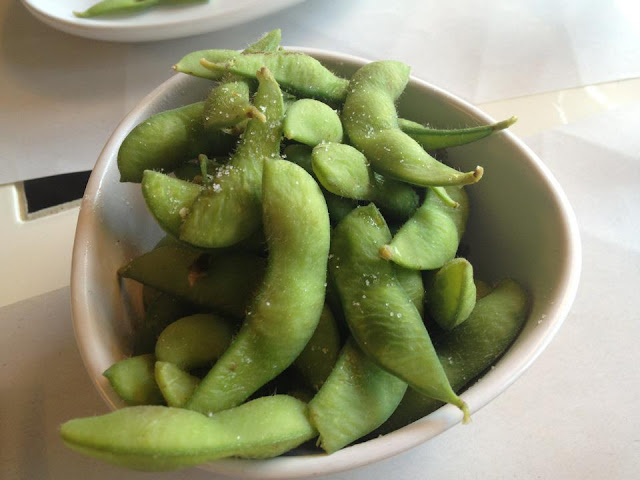
Locate an element on the screen. left rim of bowl is located at coordinates (82, 255).